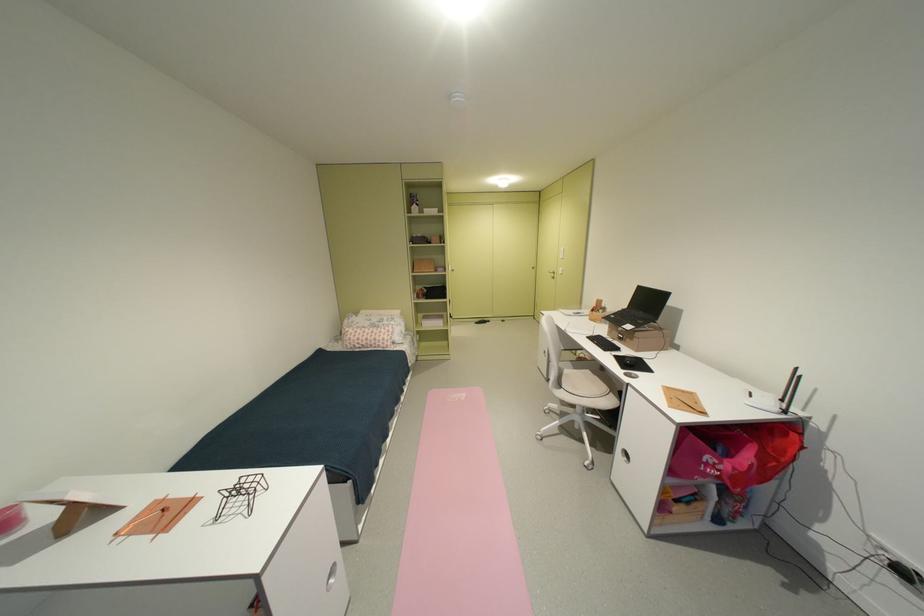
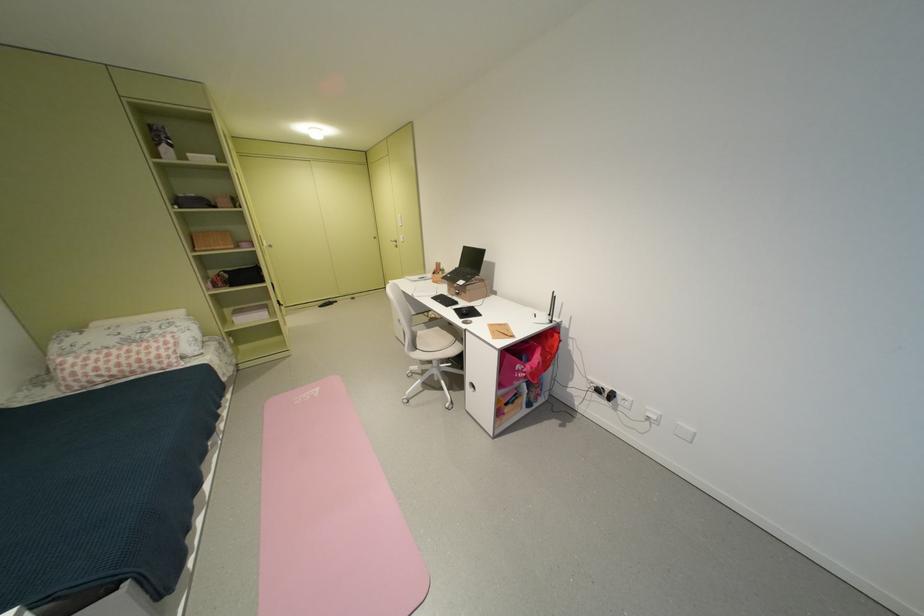
In the second image, find the point that corresponds to (611,312) in the first image.

(450, 274)